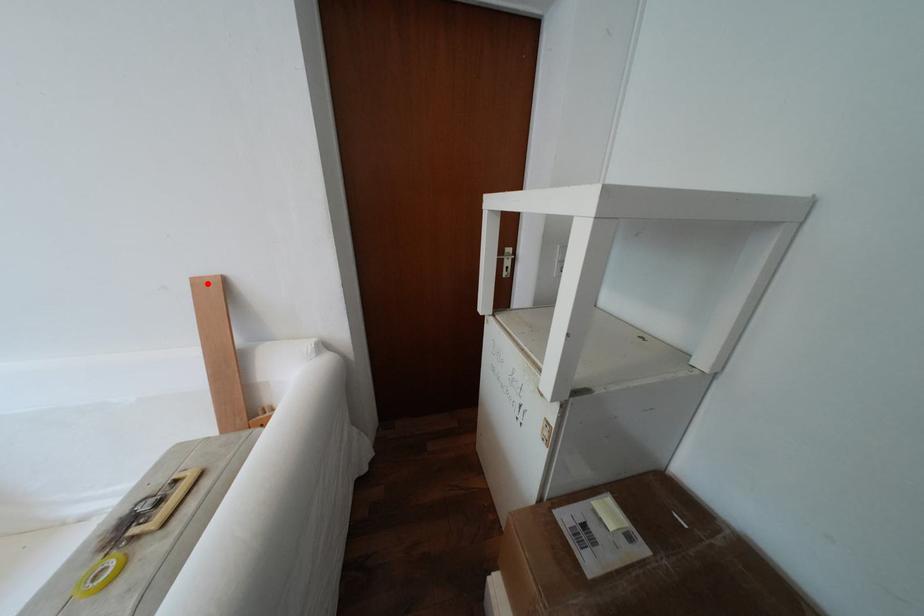
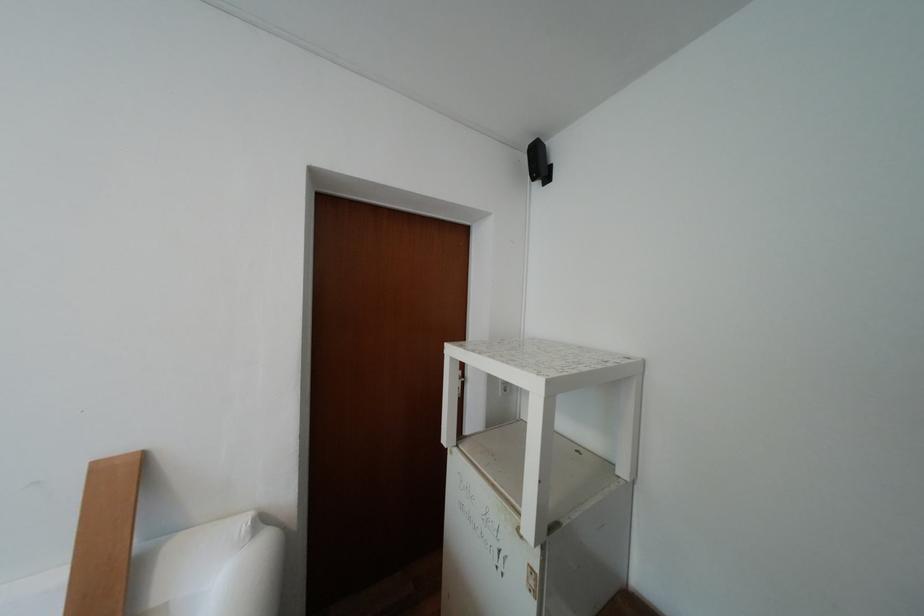
The point at the highlighted location is marked in the first image. Where is the corresponding point in the second image?

(111, 468)